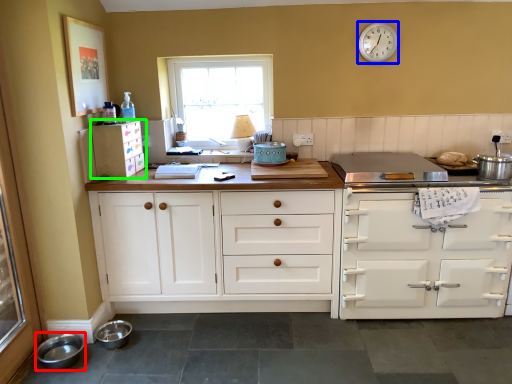
Question: Based on their relative distances, which object is farther from bowl (highlighted by a red box)? Choose from clock (highlighted by a blue box) and cabinetry (highlighted by a green box).

Choices:
 (A) clock
 (B) cabinetry

Answer: (A)